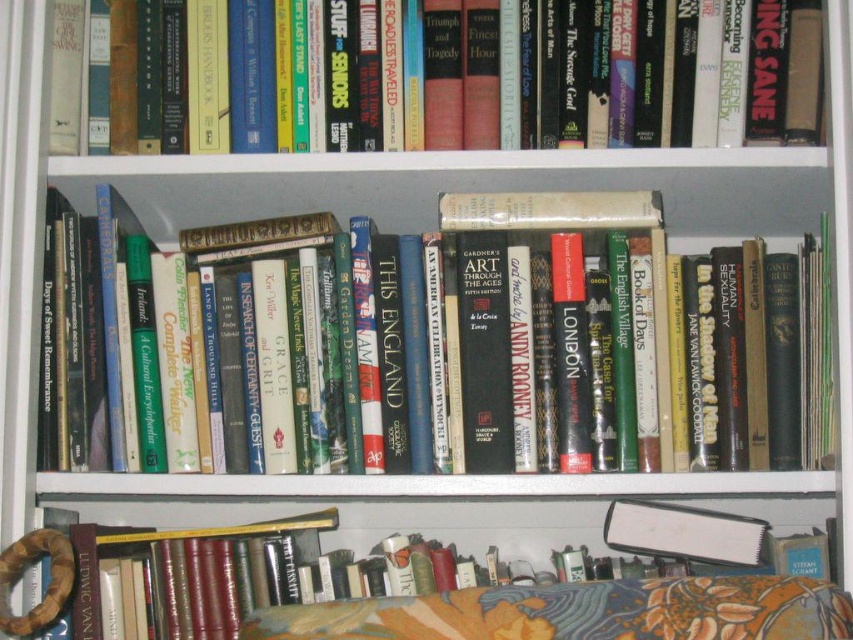
Is hardcover book at lower center thinner than floral fabric cushion at lower center?

No.

Can you confirm if hardcover book at lower center is shorter than floral fabric cushion at lower center?

No, hardcover book at lower center is not shorter than floral fabric cushion at lower center.

Which is in front, point (85, 573) or point (527, 611)?

Point (527, 611) is in front.

Identify the location of hardcover book at lower center. The height and width of the screenshot is (640, 853). click(575, 612).

Does point (769, 109) come behind point (398, 625)?

Yes, it is.

Is hardcover book at upper center positioned before floral fabric cushion at lower center?

No, it is not.

Is point (421, 74) positioned behind point (329, 609)?

Yes, point (421, 74) is behind point (329, 609).

Locate an element on the screen. hardcover book at upper center is located at coordinates (469, 76).

Is point (451, 230) positioned after point (432, 625)?

Yes, point (451, 230) is farther from viewer.

Locate an element on the screen. Image resolution: width=853 pixels, height=640 pixels. hardcover books at center is located at coordinates (469, 352).